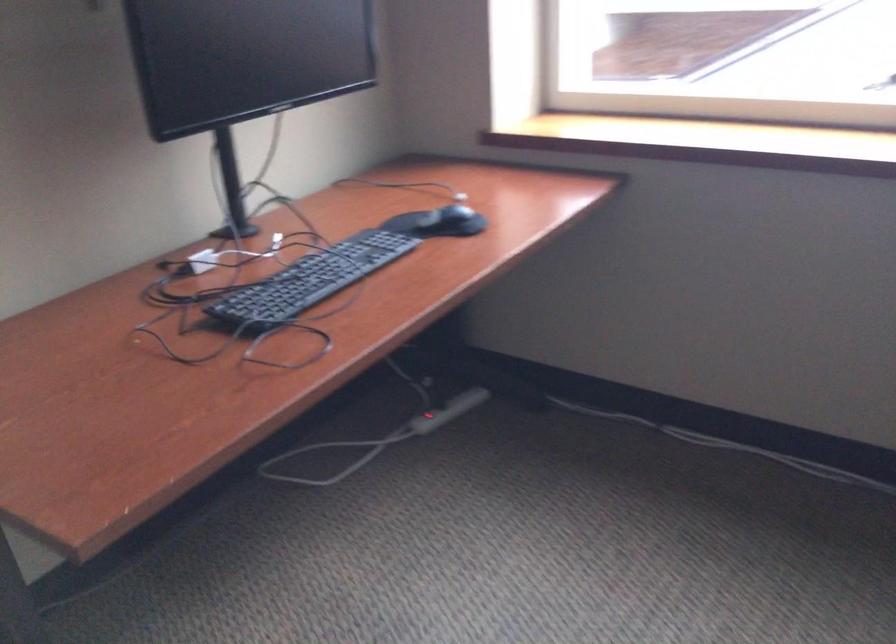
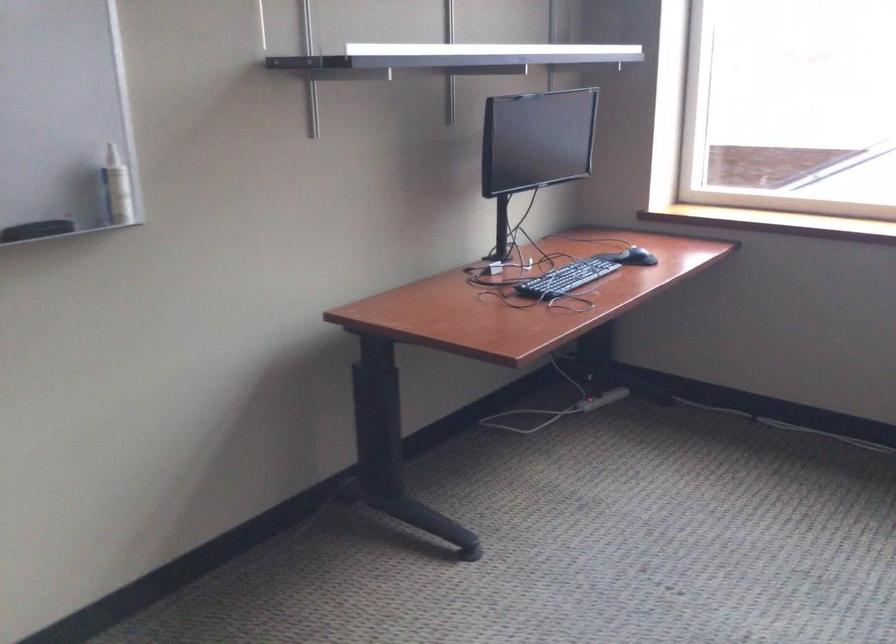
Locate, in the second image, the point that corresponds to the point at 416,426 in the first image.

(587, 404)